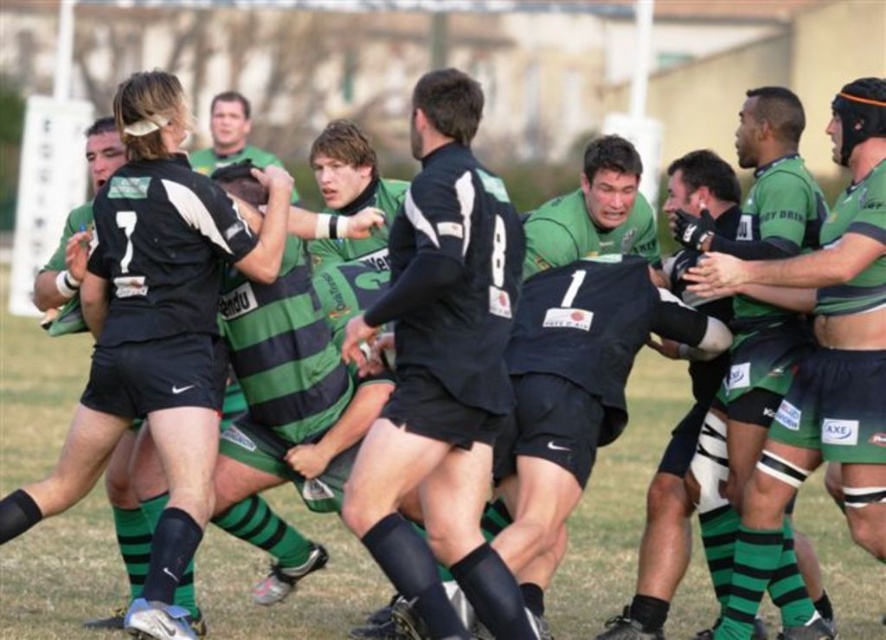
From the picture: Does matte black jersey at center appear over green striped jersey at center?

No, matte black jersey at center is not above green striped jersey at center.

From the picture: Can you confirm if matte black jersey at center is thinner than green striped jersey at center?

No, matte black jersey at center is not thinner than green striped jersey at center.

Describe the element at coordinates (443, 369) in the screenshot. I see `matte black jersey at center` at that location.

Identify the location of matte black jersey at center. (443, 369).